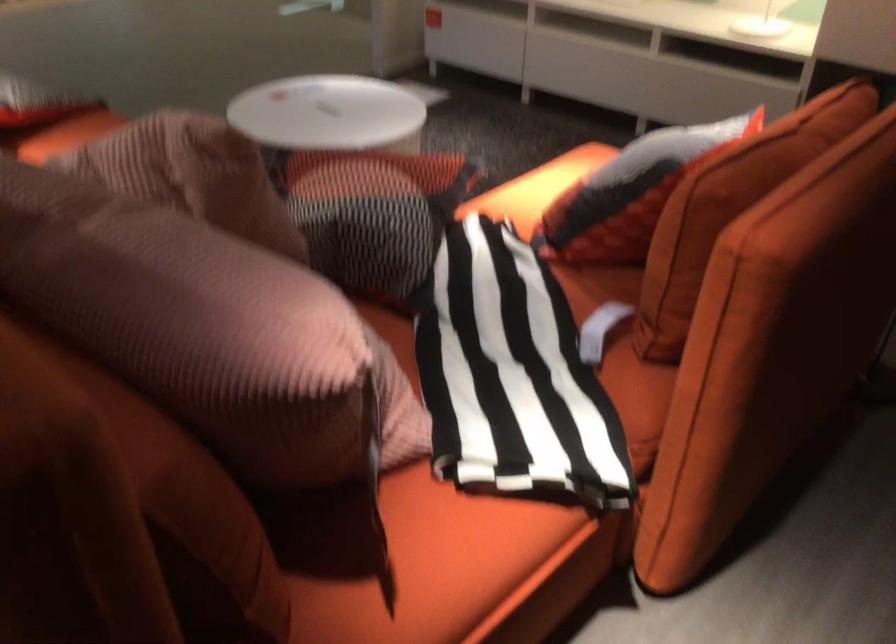
This screenshot has height=644, width=896. Identify the location of black patterned pillow. (512, 375).